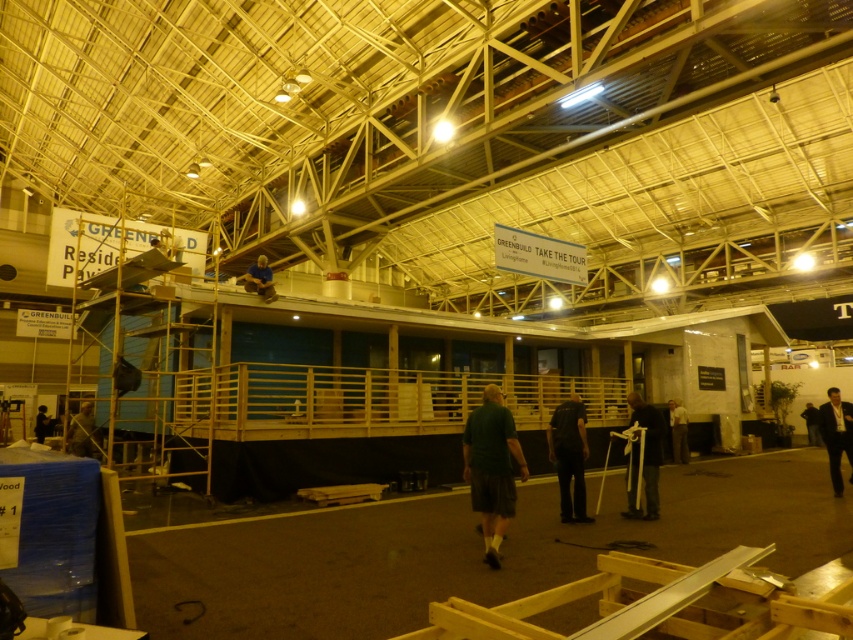
Does dark suit at lower right come behind dark gray fabric pants at lower right?

No, it is in front of dark gray fabric pants at lower right.

Between point (834, 397) and point (688, 460), which one is positioned behind?

Positioned behind is point (688, 460).

This screenshot has height=640, width=853. I want to click on dark suit at lower right, so click(836, 435).

Find the location of a particular element. Image resolution: width=853 pixels, height=640 pixels. dark suit at lower right is located at coordinates (836, 435).

Locate an element on the screen. dark gray fabric pants at center is located at coordinates (569, 456).

Who is more distant from viewer, (x=579, y=452) or (x=647, y=516)?

The point (x=579, y=452) is behind.

Who is more distant from viewer, [558,424] or [654,412]?

The point [654,412] is behind.

Where is `dark gray fabric pants at center`? dark gray fabric pants at center is located at coordinates (569, 456).

Between green matte shirt at center and dark brown leather jacket at lower right, which one appears on the right side from the viewer's perspective?

dark brown leather jacket at lower right

Image resolution: width=853 pixels, height=640 pixels. Identify the location of green matte shirt at center. (491, 467).

Where is `green matte shirt at center`? The width and height of the screenshot is (853, 640). green matte shirt at center is located at coordinates (491, 467).